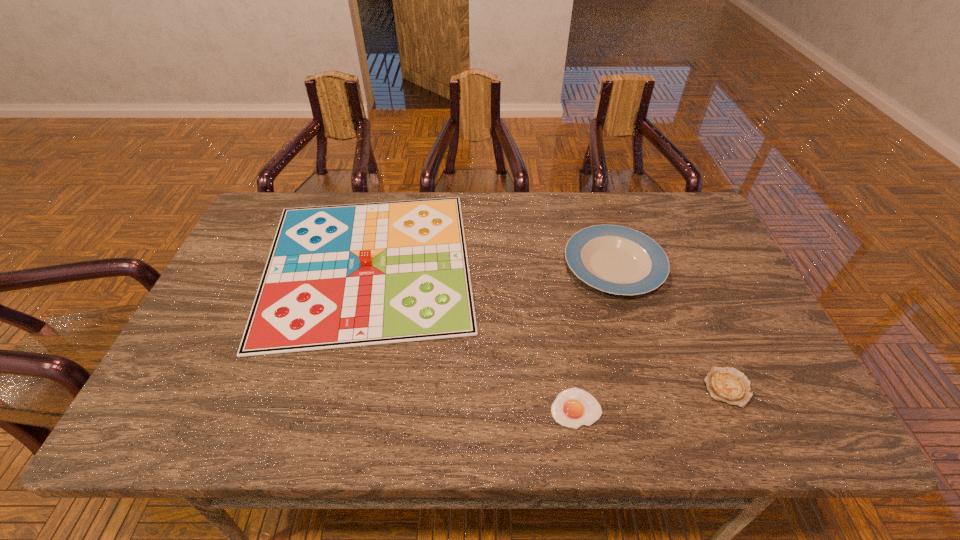
Locate an element on the screen. plate that is positioned at the far edge is located at coordinates coord(615,259).

This screenshot has width=960, height=540. I want to click on quiche that is at the near edge, so click(x=728, y=385).

Identify the location of egg yolk present at the near edge. (574, 407).

Where is `object that is at the left edge`? object that is at the left edge is located at coordinates (337, 276).

I want to click on object at the right edge, so click(728, 385).

Locate an element on the screen. The height and width of the screenshot is (540, 960). object that is at the far left corner is located at coordinates (337, 276).

Image resolution: width=960 pixels, height=540 pixels. In order to click on object that is positioned at the near right corner in this screenshot , I will do `click(728, 385)`.

Where is `vacant space at the far edge of the desktop`? This screenshot has width=960, height=540. vacant space at the far edge of the desktop is located at coordinates (592, 207).

Where is `vacant area at the near edge of the desktop`? This screenshot has height=540, width=960. vacant area at the near edge of the desktop is located at coordinates (533, 425).

Locate an element on the screen. The image size is (960, 540). vacant area at the left edge of the desktop is located at coordinates (267, 259).